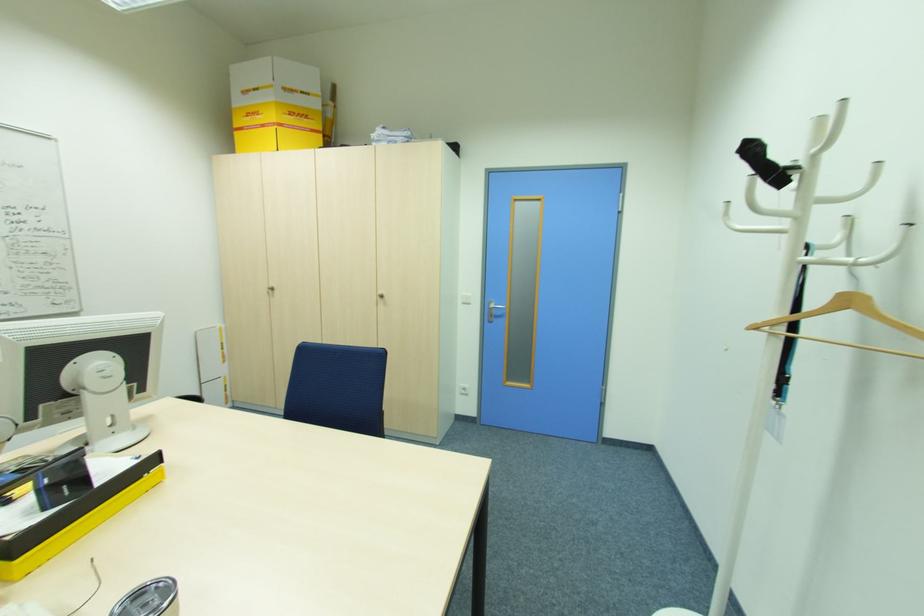
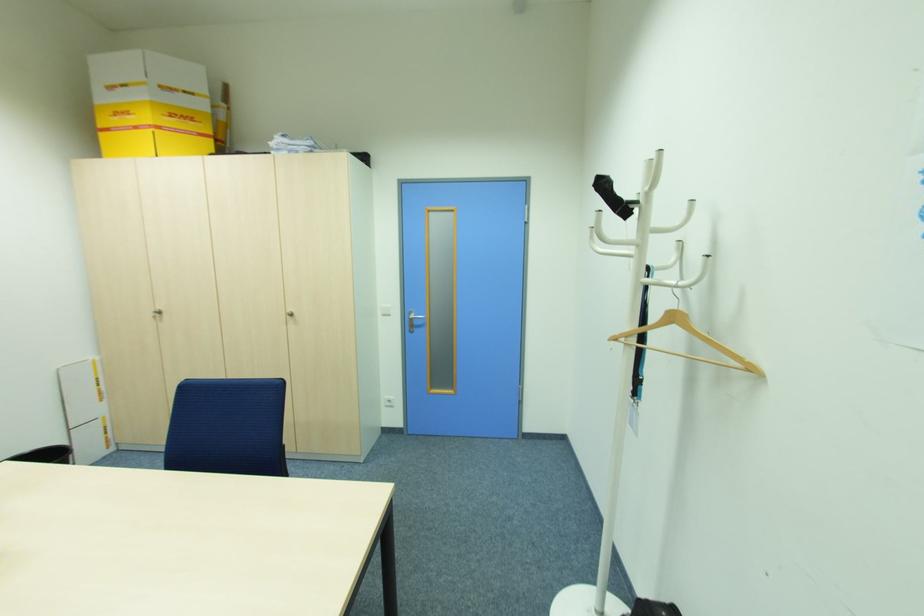
In the second image, find the point that corresponds to point (276, 100) in the first image.

(147, 95)